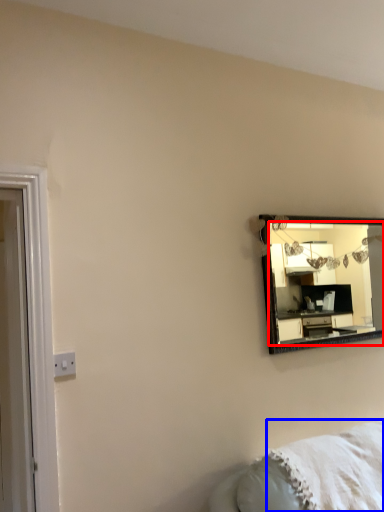
Question: Which point is closer to the camera, mirror (highlighted by a red box) or blanket (highlighted by a blue box)?

Choices:
 (A) mirror
 (B) blanket

Answer: (B)